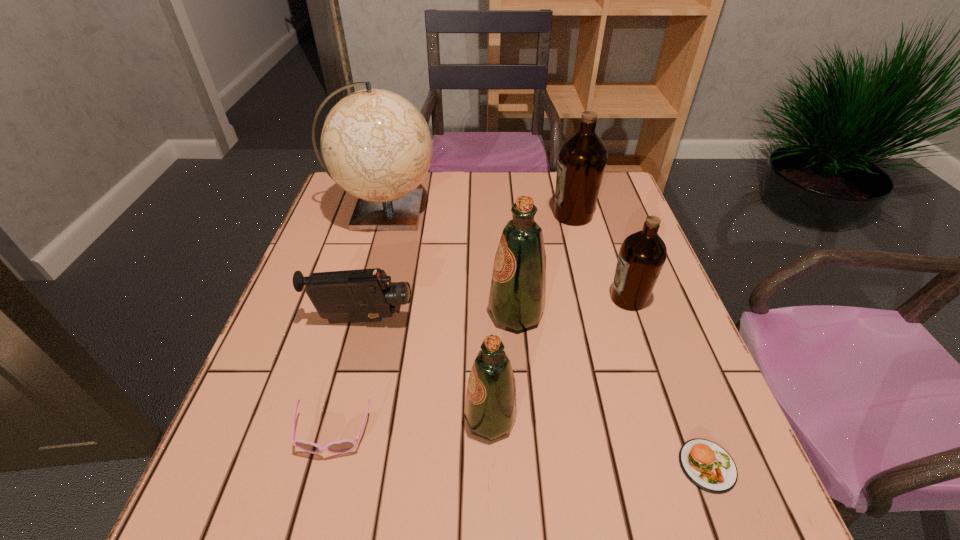
You are a GUI agent. You are given a task and a screenshot of the screen. Output one action in this format:
    pyautogui.click(x=<x>, y=<y>)
    Task: Click on the pink sunglasses
    
    Given the screenshot: What is the action you would take?
    pos(344,446)

Identify the location of the second shortest object. This screenshot has width=960, height=540. (344, 446).

Locate an element on the screen. The image size is (960, 540). patty is located at coordinates (706, 464).

You are a GUI agent. You are given a task and a screenshot of the screen. Output one action in this format:
    pyautogui.click(x=<x>, y=<y>)
    Task: Click on the vacant space located 0.300m on the surface of the tallest object showing Europe and Africa
    Image resolution: width=960 pixels, height=540 pixels.
    Given the screenshot: What is the action you would take?
    pyautogui.click(x=540, y=211)

You are a GUI agent. You are given a task and a screenshot of the screen. Output one action in this format:
    pyautogui.click(x=<x>, y=<y>)
    Task: Click on the vacant space situated 0.060m on the front-facing side of the farther green olive oil
    This screenshot has height=540, width=960.
    Given the screenshot: What is the action you would take?
    pos(462,313)

Locate an element on the screen. This screenshot has width=960, height=540. free space located 0.110m on the front-facing side of the farther green olive oil is located at coordinates (440, 313).

At what (x,y) coordinates should I click in order to perform the action: click on vacant space positioned 0.290m on the front-facing side of the farther green olive oil. Please return your answer as a coordinate pair (x, y). This screenshot has height=540, width=960. Looking at the image, I should click on (360, 313).

At what (x,y) coordinates should I click in order to perform the action: click on free point located on the label of the bigger brown olive oil. Please return your answer as a coordinate pair (x, y). This screenshot has height=540, width=960. Looking at the image, I should click on (489, 215).

Locate an element on the screen. The image size is (960, 540). vacant area situated 0.290m on the label of the bigger brown olive oil is located at coordinates (450, 215).

Identify the location of vacant position located on the label of the bigger brown olive oil. This screenshot has width=960, height=540. [523, 215].